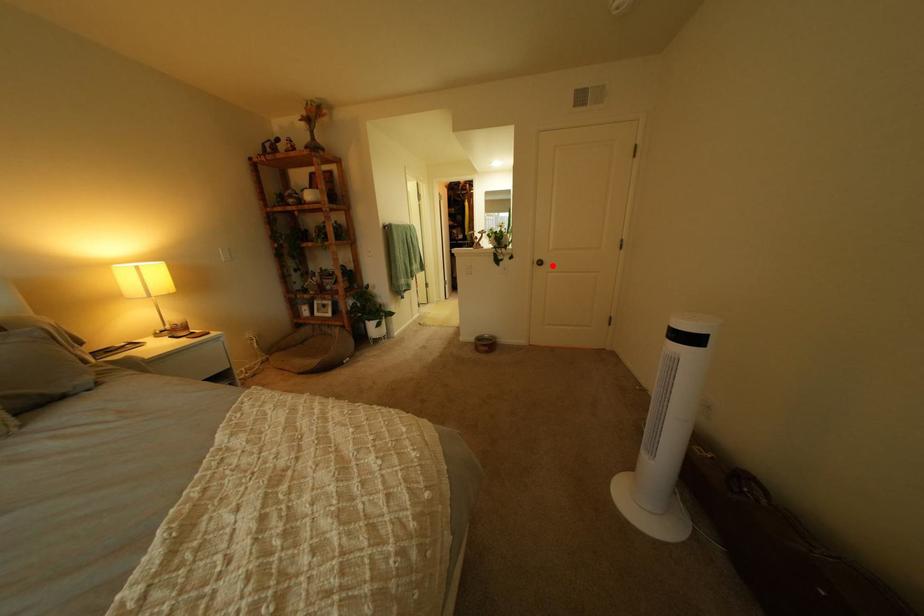
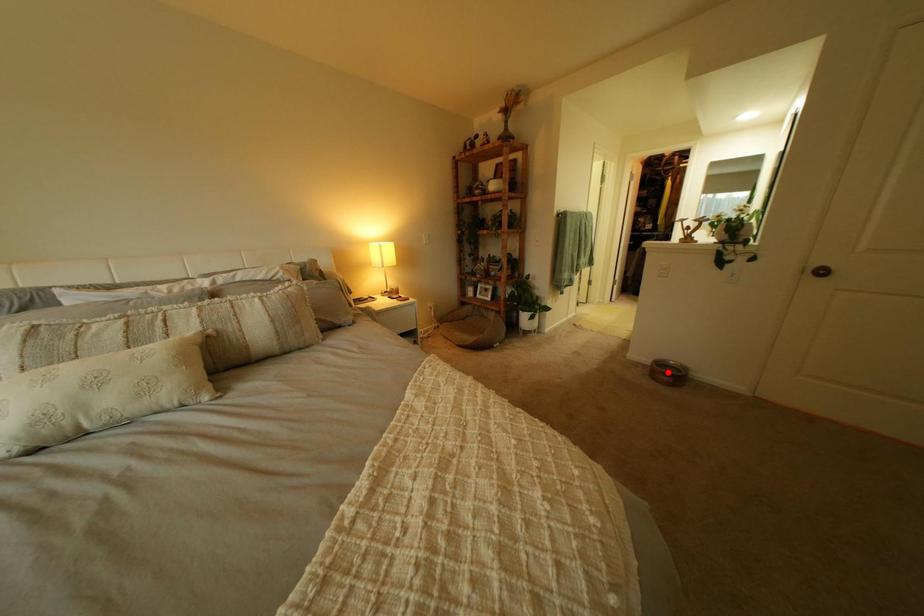
In the scene shown: I am providing you with two images of the same scene from different viewpoints. A red point is marked on the first image and another point is marked on the second image. Is the marked point in image1 the same physical position as the marked point in image2?

No